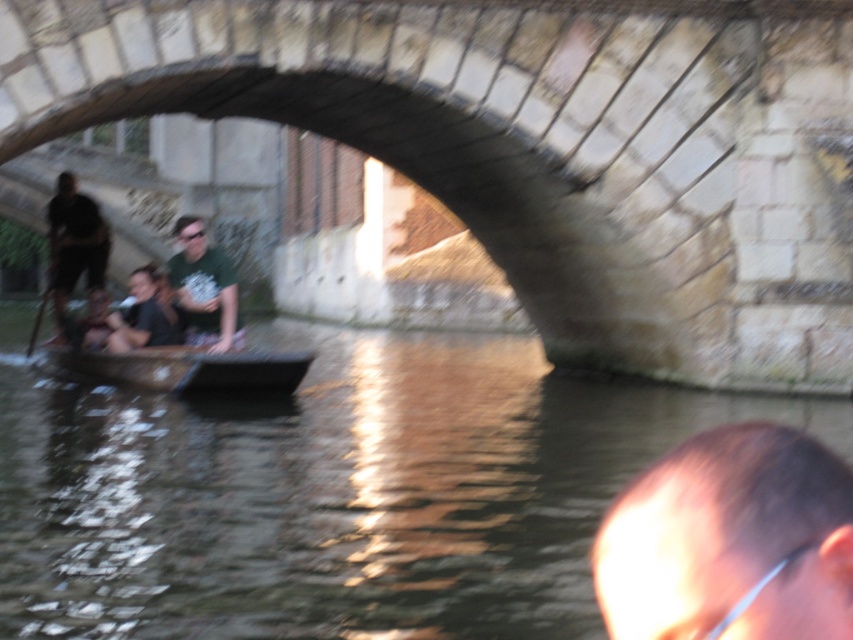
Is point (202, 246) positioned after point (119, 312)?

No, it is in front of (119, 312).

Can you confirm if green matte shirt at center is bigger than dark green shirt at center?

Yes, green matte shirt at center is bigger than dark green shirt at center.

Find the location of a particular element. The height and width of the screenshot is (640, 853). green matte shirt at center is located at coordinates (204, 289).

Is brown wooden boat at lower left closer to the viewer compared to wooden canoe at center?

That is True.

Can you confirm if brown wooden boat at lower left is smaller than wooden canoe at center?

No.

Between point (428, 538) and point (100, 380), which one is positioned behind?

Point (100, 380)

Find the location of a particular element. The image size is (853, 640). brown wooden boat at lower left is located at coordinates (335, 492).

Who is taller, stone bridge at center or dark green shirt at left?

Standing taller between the two is dark green shirt at left.

Can you confirm if stone bridge at center is shorter than dark green shirt at left?

Indeed, stone bridge at center has a lesser height compared to dark green shirt at left.

Identify the location of stone bridge at center. (532, 147).